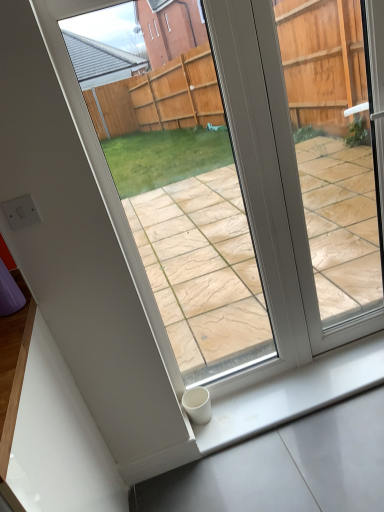
Question: Which is correct: transparent glass door at center is inside white glossy window sill at lower right, or outside of it?

Choices:
 (A) outside
 (B) inside

Answer: (A)

Question: Based on their sizes in the image, would you say transparent glass door at center is bigger or smaller than white glossy window sill at lower right?

Choices:
 (A) big
 (B) small

Answer: (A)

Question: Considering the relative positions of transparent glass door at center and white glossy window sill at lower right in the image provided, is transparent glass door at center to the left or to the right of white glossy window sill at lower right?

Choices:
 (A) right
 (B) left

Answer: (A)

Question: From a real-world perspective, is white glossy window sill at lower right above or below transparent glass door at center?

Choices:
 (A) above
 (B) below

Answer: (B)

Question: Is white glossy window sill at lower right taller or shorter than transparent glass door at center?

Choices:
 (A) tall
 (B) short

Answer: (B)

Question: Is white glossy window sill at lower right wider or thinner than transparent glass door at center?

Choices:
 (A) thin
 (B) wide

Answer: (B)

Question: From the image's perspective, is white glossy window sill at lower right located above or below transparent glass door at center?

Choices:
 (A) above
 (B) below

Answer: (B)